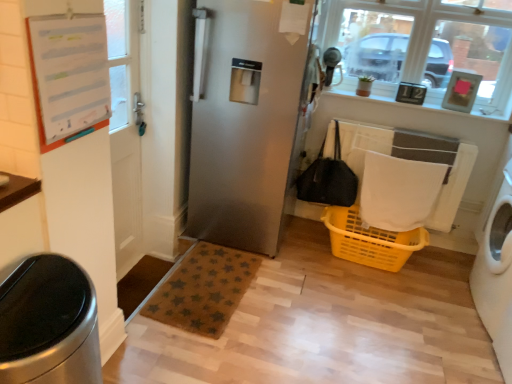
You are a GUI agent. You are given a task and a screenshot of the screen. Output one action in this format:
    pyautogui.click(x=<x>, y=<y>)
    Task: Click on the free space in front of satin silver refrigerator at center
    This screenshot has height=384, width=512.
    Given the screenshot: What is the action you would take?
    pyautogui.click(x=287, y=304)